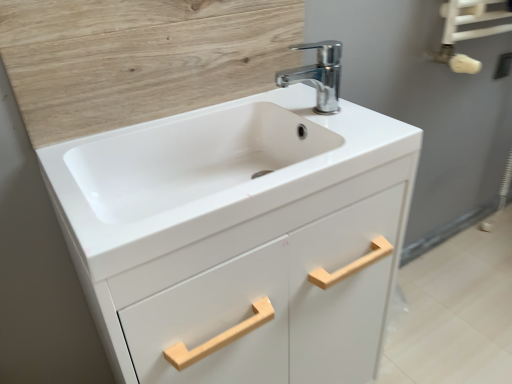
You are a GUI agent. You are given a task and a screenshot of the screen. Output one action in this format:
    pyautogui.click(x=<x>, y=<y>)
    Task: Click on the vacant space in front of chrome metallic faucet at upper center
    Image resolution: width=512 pixels, height=384 pixels.
    Given the screenshot: What is the action you would take?
    (346, 139)